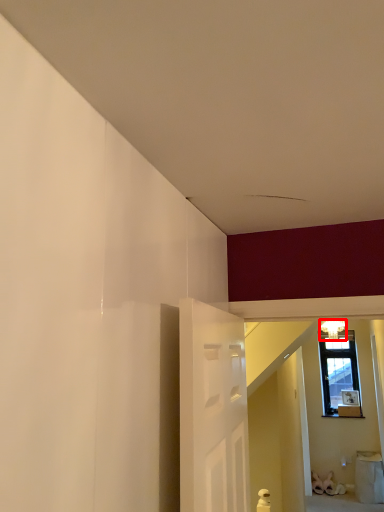
Question: Considering the relative positions of light fixture (annotated by the red box) and furniture in the image provided, where is light fixture (annotated by the red box) located with respect to the staircase?

Choices:
 (A) left
 (B) right

Answer: (A)